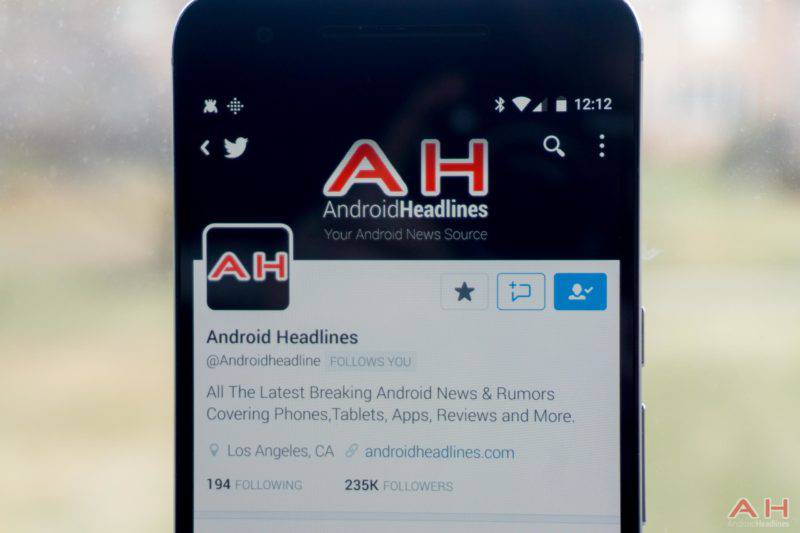
You are a GUI agent. You are given a task and a screenshot of the screen. Output one action in this format:
    pyautogui.click(x=<x>, y=<y>)
    Task: Click on the phone screen
    Image resolution: width=800 pixels, height=533 pixels.
    Given the screenshot: What is the action you would take?
    pyautogui.click(x=540, y=365)